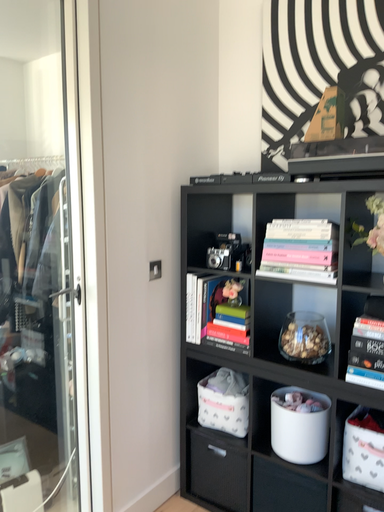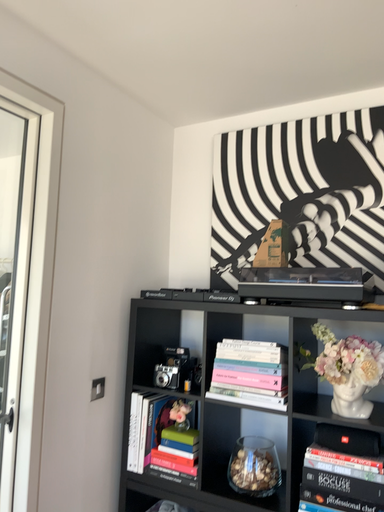
Question: Which way did the camera rotate in the video?

Choices:
 (A) rotated upward
 (B) rotated downward

Answer: (A)